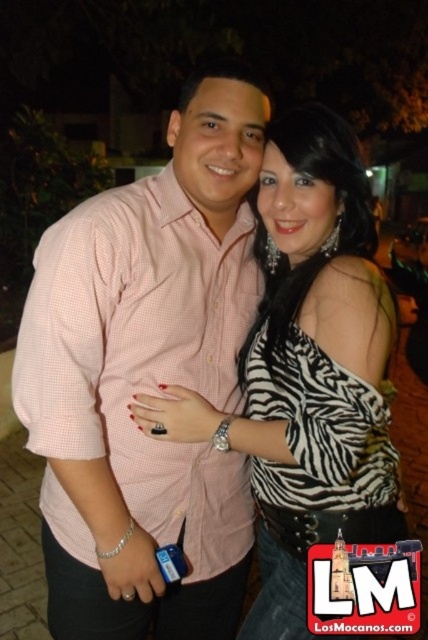
What do you see at coordinates (146, 378) in the screenshot?
I see `pink checkered shirt at center` at bounding box center [146, 378].

You are a GUI agent. You are given a task and a screenshot of the screen. Output one action in this format:
    pyautogui.click(x=<x>, y=<y>)
    Task: Click on the pink checkered shirt at center
    This screenshot has width=428, height=640.
    Given the screenshot: What is the action you would take?
    pyautogui.click(x=146, y=378)

Does point (56, 572) lie behind point (261, 188)?

No, (56, 572) is closer to viewer.

Where is `pink checkered shirt at center`? This screenshot has height=640, width=428. pink checkered shirt at center is located at coordinates (146, 378).